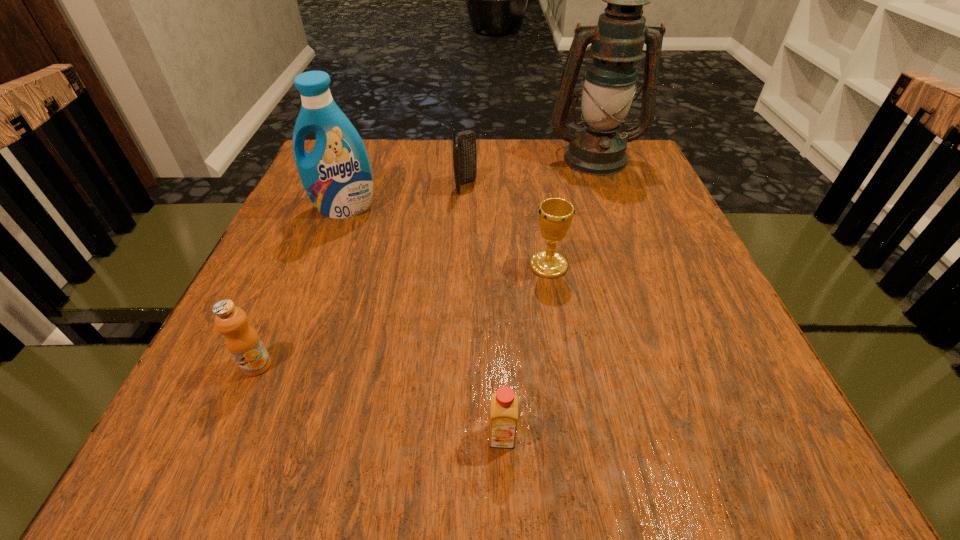
Find the location of a particular element. This screenshot has width=960, height=540. the rightmost object is located at coordinates (617, 41).

You are a GUI agent. You are given a task and a screenshot of the screen. Output one action in this format:
    pyautogui.click(x=<x>, y=<y>)
    Task: Click on the tallest object
    Image resolution: width=960 pixels, height=540 pixels.
    Given the screenshot: What is the action you would take?
    pyautogui.click(x=617, y=41)

You are a GUI agent. You are given a task and a screenshot of the screen. Output one action in this format:
    pyautogui.click(x=<x>, y=<y>)
    Task: Click on the fourth nearest object
    This screenshot has height=540, width=960.
    Given the screenshot: What is the action you would take?
    [336, 175]

Where is `detergent`? This screenshot has height=540, width=960. detergent is located at coordinates (336, 175).

Where is `the fourth object from right to left`? This screenshot has height=540, width=960. the fourth object from right to left is located at coordinates (464, 143).

You are a GUI agent. You are given a task and a screenshot of the screen. Output one action in this format:
    pyautogui.click(x=<x>, y=<y>)
    Task: Click on the cellular telephone
    The height and width of the screenshot is (540, 960).
    Given the screenshot: What is the action you would take?
    pyautogui.click(x=464, y=143)

In order to click on chalice in this screenshot , I will do `click(555, 214)`.

You are a GUI agent. You are given a task and a screenshot of the screen. Output one action in this format:
    pyautogui.click(x=<x>, y=<y>)
    Task: Click on the fourth farthest object
    The height and width of the screenshot is (540, 960).
    Given the screenshot: What is the action you would take?
    pyautogui.click(x=555, y=214)

This screenshot has width=960, height=540. In order to click on the left orange juice in this screenshot , I will do `click(242, 340)`.

What are the coordinates of `the fifth farthest object` in the screenshot? It's located at (242, 340).